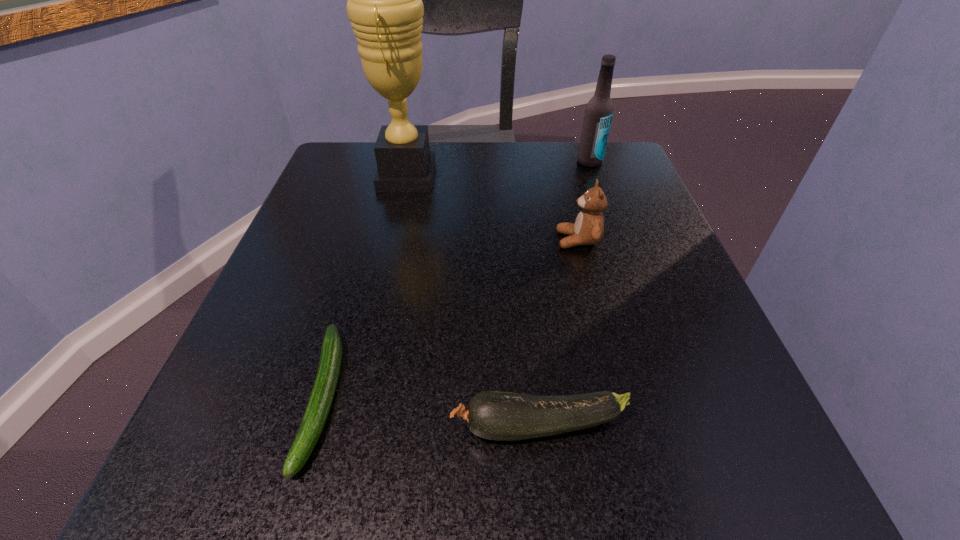
The height and width of the screenshot is (540, 960). Find the location of `zucchini that is at the left edge`. zucchini that is at the left edge is located at coordinates (321, 398).

Where is `beer bottle at the right edge`? This screenshot has height=540, width=960. beer bottle at the right edge is located at coordinates (599, 110).

I want to click on teddy bear that is positioned at the right edge, so 588,229.

You are a GUI agent. You are given a task and a screenshot of the screen. Output one action in this format:
    pyautogui.click(x=<x>, y=<y>)
    Task: Click on the object at the far left corner
    This screenshot has height=540, width=960.
    Given the screenshot: What is the action you would take?
    pyautogui.click(x=385, y=7)

This screenshot has height=540, width=960. Find the location of `object that is at the near left corner`. object that is at the near left corner is located at coordinates (321, 398).

Locate an element on the screen. object located at the far right corner is located at coordinates point(599,110).

This screenshot has width=960, height=540. Find the location of `vacant space at the far edge of the desktop`. vacant space at the far edge of the desktop is located at coordinates (444, 166).

This screenshot has height=540, width=960. What are the coordinates of `free space at the near edge of the desktop` in the screenshot? It's located at (626, 489).

Where is `vacant space at the left edge`? Image resolution: width=960 pixels, height=540 pixels. vacant space at the left edge is located at coordinates (297, 235).

Find the location of a particular element. blank space at the right edge of the desktop is located at coordinates (733, 392).